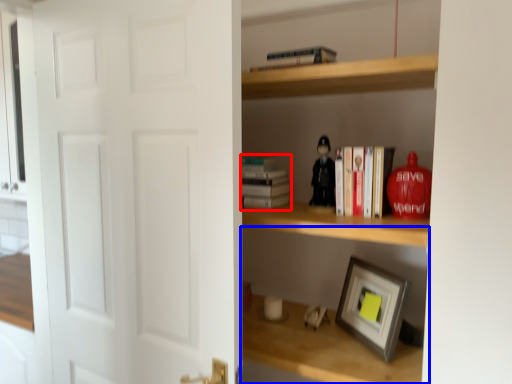
Question: Which object appears farthest to the camera in this image, paperback book (highlighted by a red box) or shelf (highlighted by a blue box)?

Choices:
 (A) paperback book
 (B) shelf

Answer: (A)